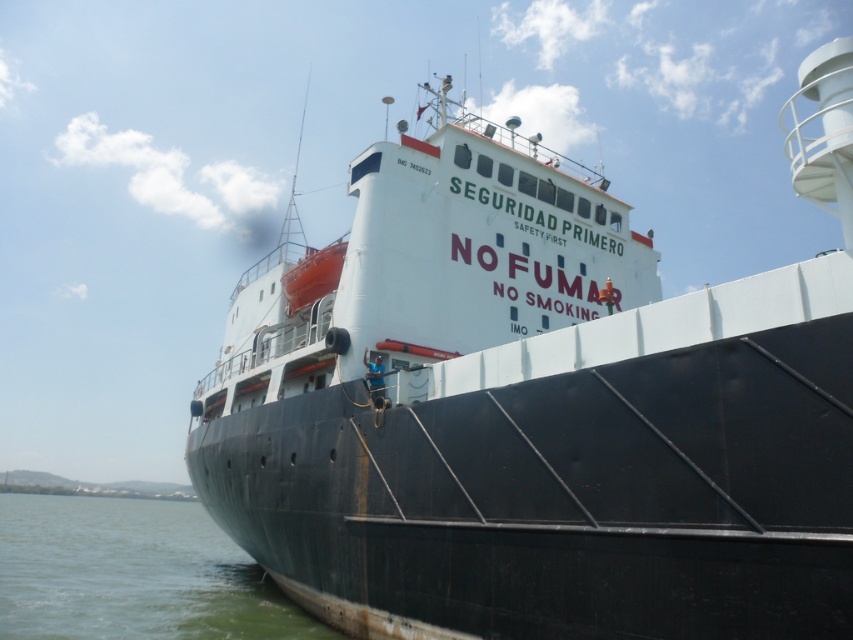
Question: Considering the relative positions of black matte ship at center and green water at lower left in the image provided, where is black matte ship at center located with respect to green water at lower left?

Choices:
 (A) right
 (B) left

Answer: (A)

Question: Can you confirm if black matte ship at center is positioned above green water at lower left?

Choices:
 (A) yes
 (B) no

Answer: (A)

Question: Among these points, which one is farthest from the camera?

Choices:
 (A) (230, 408)
 (B) (38, 588)

Answer: (B)

Question: Can you confirm if black matte ship at center is smaller than green water at lower left?

Choices:
 (A) yes
 (B) no

Answer: (A)